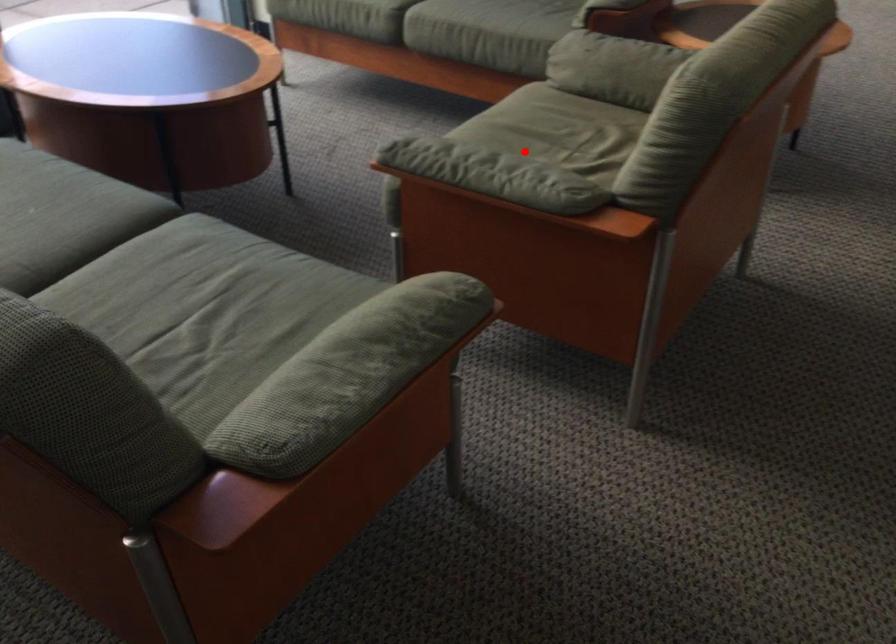
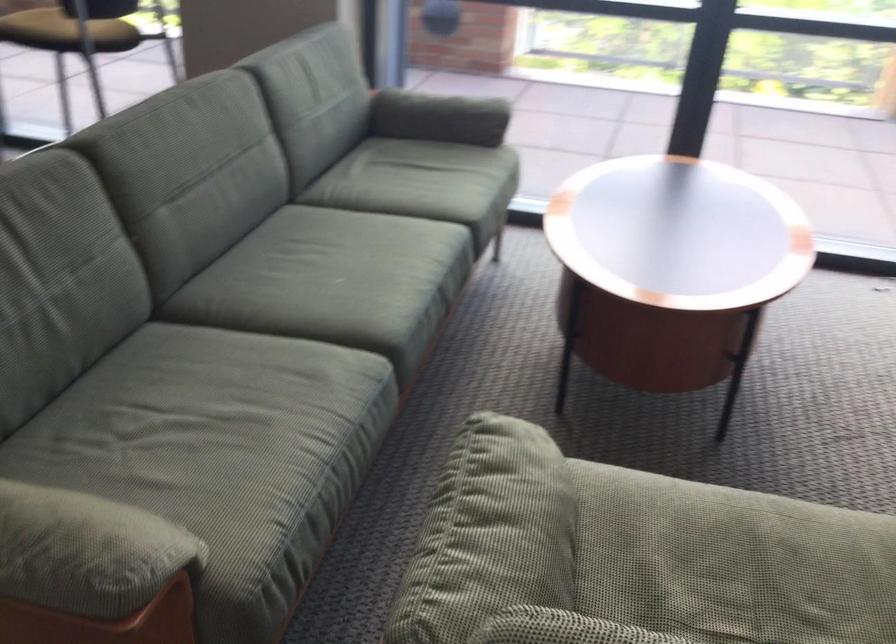
Question: I am providing you with two images of the same scene from different viewpoints. A red point is shown in image1. For the corresponding object point in image2, is it positioned nearer or farther from the camera?

Choices:
 (A) Nearer
 (B) Farther

Answer: (A)